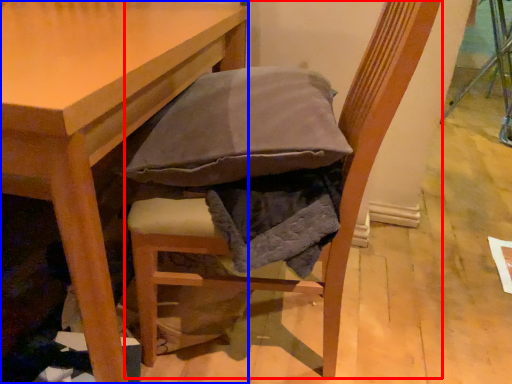
Question: Which object appears farthest to the camera in this image, chair (highlighted by a red box) or table (highlighted by a blue box)?

Choices:
 (A) chair
 (B) table

Answer: (A)